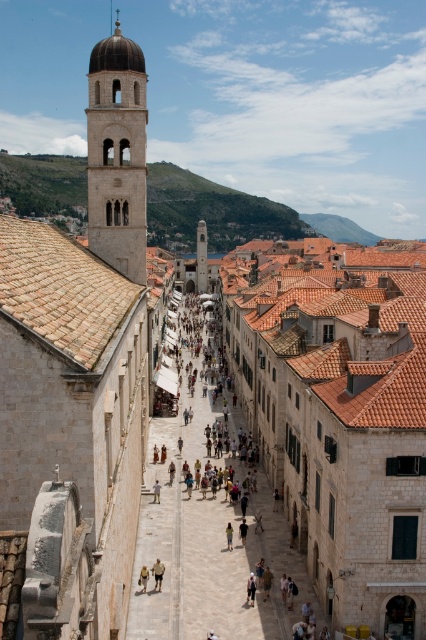
You are standing on a cobblestone street in Dubrovnik, Croatia, and you see a point marked at coordinates [201,257]. Based on the scene, where is this point located?

The point at coordinates [201,257] is located on the smooth stone bell tower at center.